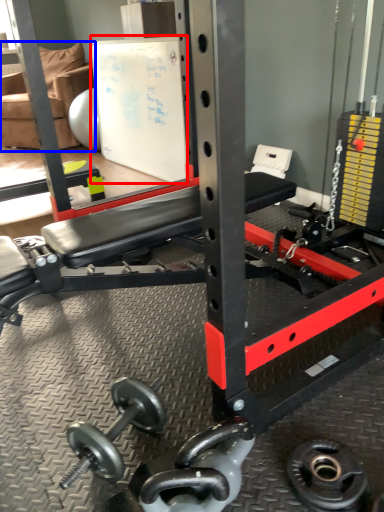
Question: Which object is further to the camera taking this photo, bulletin board (highlighted by a red box) or chair (highlighted by a blue box)?

Choices:
 (A) bulletin board
 (B) chair

Answer: (B)